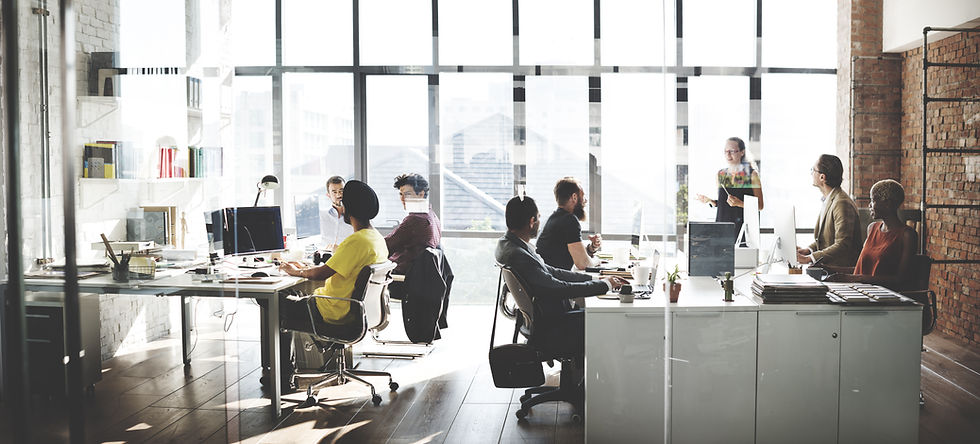
I want to click on computer monitors, so pos(218,236), pos(257,232), pos(312,213), pos(756,210), pos(782,234), pos(637,218).